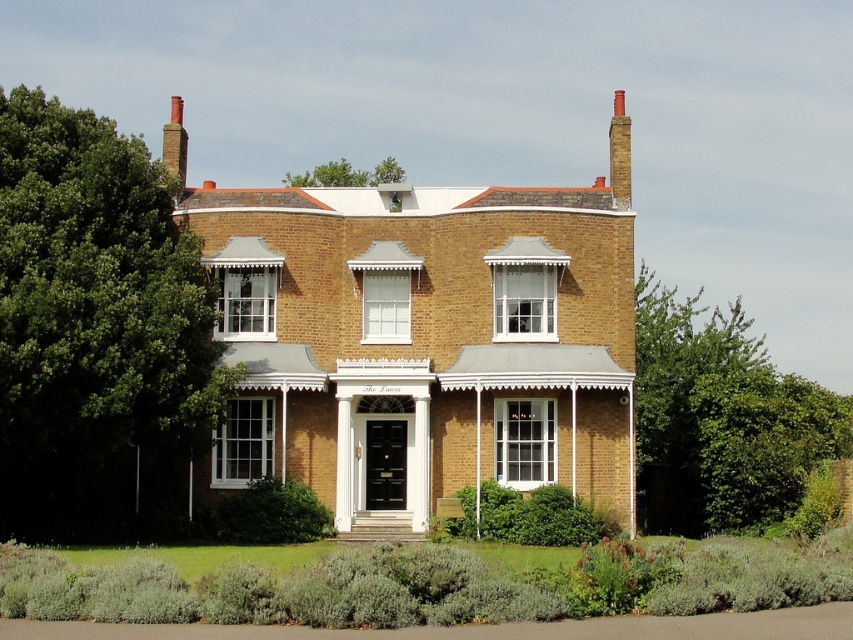
You are standing in front of the two story brick house. There is a point marked at coordinate [96,330]. What object is located at that point?

The point at coordinate [96,330] indicates a green leafy tree at left.